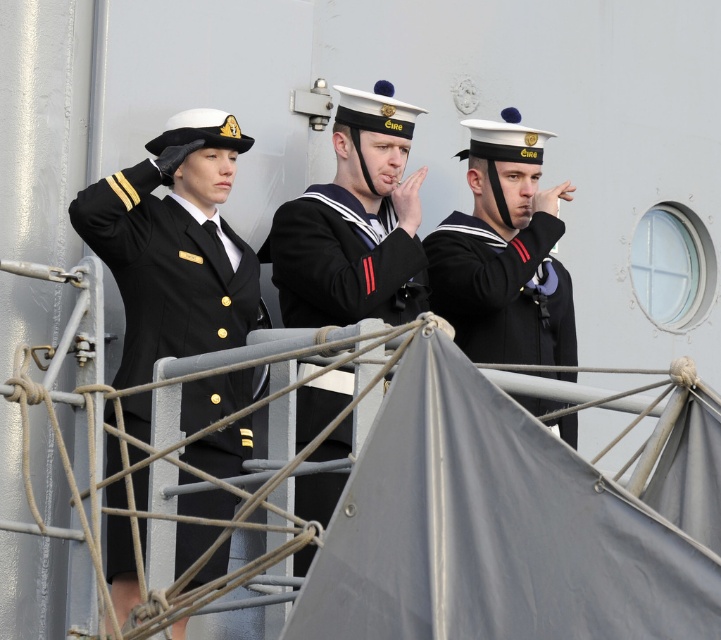
You are a sailor on the ship deck. You need to hand over a confidential document to the sailor wearing the sailor uniform at center. However, you are currently holding a black woolen sweater at center. Can you safely pass the document without dropping the sweater?

The black woolen sweater at center is 1.34 meters away from the sailor uniform at center. Since the sweater is being held by you, you can hand over the document to the sailor wearing the sailor uniform at center while keeping the sweater in your other hand, as the distance allows for safe transfer.

You are a photographer on the ship deck. You need to take a photo of the black matte uniform at left and the sailor uniform at center. Based on their positions, which one will appear closer to the bottom of the photo?

The black matte uniform at left is below the sailor uniform at center, so it will appear closer to the bottom of the photo.

You are a photographer standing on the deck of a ship. You want to take a photo of the black matte uniform at left and the sailor uniform at center. The minimum distance required for your camera to focus clearly on both subjects is 10 feet. Can you capture both subjects in focus from your current position?

The black matte uniform at left is 12.42 feet away from the sailor uniform at center. Since the minimum focus distance is 10 feet, the camera can capture both subjects in focus as they are more than 10 feet apart.